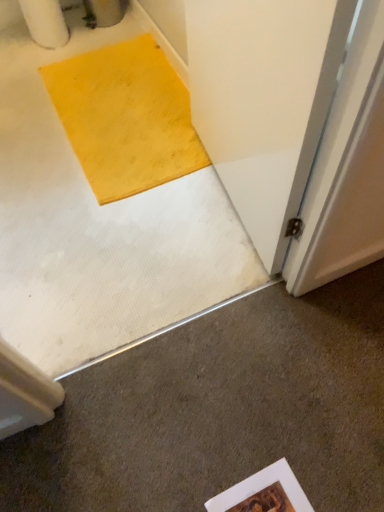
In order to click on wooden frame at lower center in this screenshot , I will do `click(264, 493)`.

This screenshot has height=512, width=384. What do you see at coordinates (264, 493) in the screenshot?
I see `wooden frame at lower center` at bounding box center [264, 493].

This screenshot has width=384, height=512. What do you see at coordinates (221, 410) in the screenshot?
I see `white smooth concrete at lower left` at bounding box center [221, 410].

You are a GUI agent. You are given a task and a screenshot of the screen. Output one action in this format:
    pyautogui.click(x=<x>, y=<y>)
    Task: Click on the white smooth concrete at lower left
    
    Given the screenshot: What is the action you would take?
    pyautogui.click(x=221, y=410)

The height and width of the screenshot is (512, 384). I want to click on wooden frame at lower center, so click(264, 493).

In the image, is wooden frame at lower center on the left side or the right side of white smooth concrete at lower left?

Based on their positions, wooden frame at lower center is located to the right of white smooth concrete at lower left.

Is the position of wooden frame at lower center more distant than that of white smooth concrete at lower left?

Yes, it is behind white smooth concrete at lower left.

Which is behind, point (291, 498) or point (223, 390)?

The point (223, 390) is farther.

From the image's perspective, is wooden frame at lower center on top of white smooth concrete at lower left?

No, from the image's perspective, wooden frame at lower center is not on top of white smooth concrete at lower left.

In the scene shown: From a real-world perspective, between wooden frame at lower center and white smooth concrete at lower left, who is vertically higher?

white smooth concrete at lower left, from a real-world perspective.

Is wooden frame at lower center wider or thinner than white smooth concrete at lower left?

In the image, wooden frame at lower center appears to be more narrow than white smooth concrete at lower left.

Between wooden frame at lower center and white smooth concrete at lower left, which one has more height?

white smooth concrete at lower left.

Between wooden frame at lower center and white smooth concrete at lower left, which one has larger size?

Bigger between the two is white smooth concrete at lower left.

Is white smooth concrete at lower left completely or partially inside wooden frame at lower center?

No, white smooth concrete at lower left is located outside of wooden frame at lower center.

Is wooden frame at lower center touching white smooth concrete at lower left?

No, wooden frame at lower center is not making contact with white smooth concrete at lower left.

Is wooden frame at lower center oriented away from white smooth concrete at lower left?

Yes, wooden frame at lower center is positioned with its back facing white smooth concrete at lower left.

How many degrees apart are the facing directions of wooden frame at lower center and white smooth concrete at lower left?

The angle between the facing direction of wooden frame at lower center and the facing direction of white smooth concrete at lower left is 177 degrees.

How distant is wooden frame at lower center from white smooth concrete at lower left?

The distance of wooden frame at lower center from white smooth concrete at lower left is 21.77 centimeters.

Where is `writing located on the right of white smooth concrete at lower left`? writing located on the right of white smooth concrete at lower left is located at coordinates pyautogui.click(x=264, y=493).

Which is more to the left, white smooth concrete at lower left or wooden frame at lower center?

From the viewer's perspective, white smooth concrete at lower left appears more on the left side.

Is white smooth concrete at lower left positioned behind wooden frame at lower center?

No, white smooth concrete at lower left is closer to the camera.

Is point (328, 439) positioned before point (258, 476)?

No, it is behind (258, 476).

From the image's perspective, between white smooth concrete at lower left and wooden frame at lower center, who is located below?

wooden frame at lower center.

From a real-world perspective, is white smooth concrete at lower left below wooden frame at lower center?

No, from a real-world perspective, white smooth concrete at lower left is not under wooden frame at lower center.

Considering the relative sizes of white smooth concrete at lower left and wooden frame at lower center in the image provided, is white smooth concrete at lower left wider than wooden frame at lower center?

Indeed, white smooth concrete at lower left has a greater width compared to wooden frame at lower center.

Considering the relative sizes of white smooth concrete at lower left and wooden frame at lower center in the image provided, is white smooth concrete at lower left shorter than wooden frame at lower center?

No.

Who is smaller, white smooth concrete at lower left or wooden frame at lower center?

Smaller between the two is wooden frame at lower center.

Can we say white smooth concrete at lower left lies outside wooden frame at lower center?

white smooth concrete at lower left lies outside wooden frame at lower center's area.

Is white smooth concrete at lower left next to wooden frame at lower center and touching it?

white smooth concrete at lower left and wooden frame at lower center are not in contact.

Is white smooth concrete at lower left aimed at wooden frame at lower center?

Yes, white smooth concrete at lower left is facing wooden frame at lower center.

How many degrees apart are the facing directions of white smooth concrete at lower left and wooden frame at lower center?

white smooth concrete at lower left and wooden frame at lower center are facing 177 degrees away from each other.

Locate an element on the screen. The image size is (384, 512). writing below the white smooth concrete at lower left (from the image's perspective) is located at coordinates (264, 493).

Identify the location of concrete lying on the left of wooden frame at lower center. (221, 410).

The width and height of the screenshot is (384, 512). Identify the location of writing behind the white smooth concrete at lower left. (264, 493).